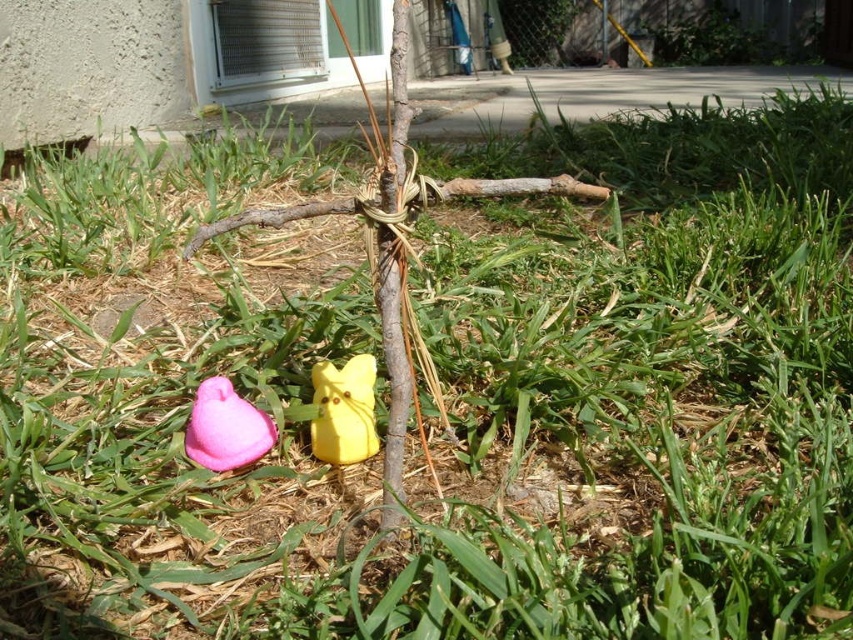
Question: Can you confirm if yellow matte plush at center is bigger than matte pink peep at lower left?

Choices:
 (A) no
 (B) yes

Answer: (A)

Question: Is yellow matte plush at center further to camera compared to matte pink peep at lower left?

Choices:
 (A) yes
 (B) no

Answer: (A)

Question: Is yellow matte plush at center to the right of matte pink peep at lower left from the viewer's perspective?

Choices:
 (A) no
 (B) yes

Answer: (B)